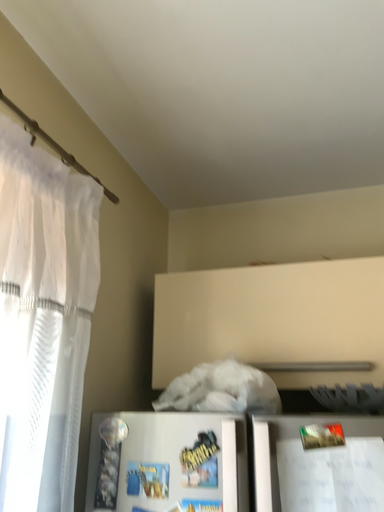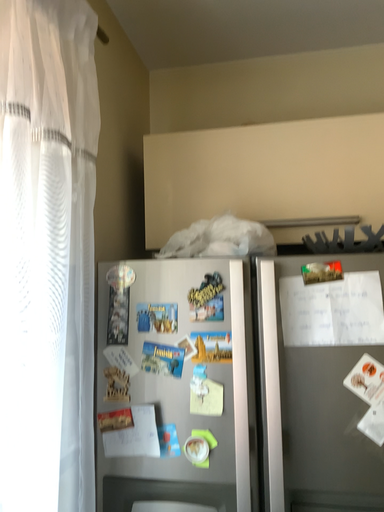
Question: Which way did the camera rotate in the video?

Choices:
 (A) rotated upward
 (B) rotated downward

Answer: (B)